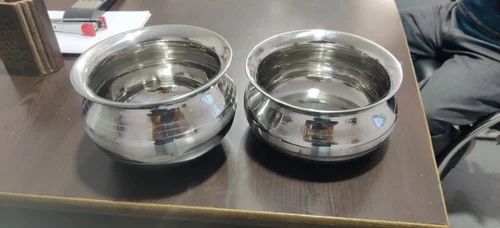
At what (x,y) coordinates should I click in order to perform the action: click on stapler. Please return your answer as a coordinate pair (x, y). The height and width of the screenshot is (228, 500). Looking at the image, I should click on (76, 25).